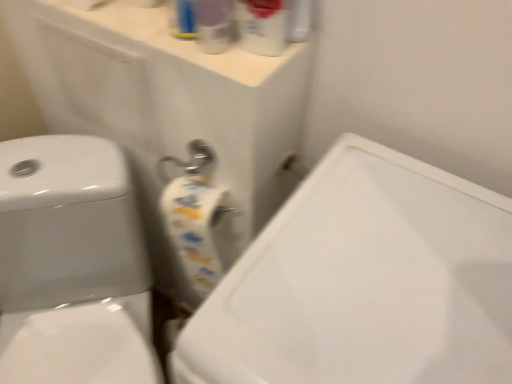
Identify the location of vacant space positioned to the left of translucent plastic spray bottle at upper center, which is the second cleaning product from left to right. point(161,43).